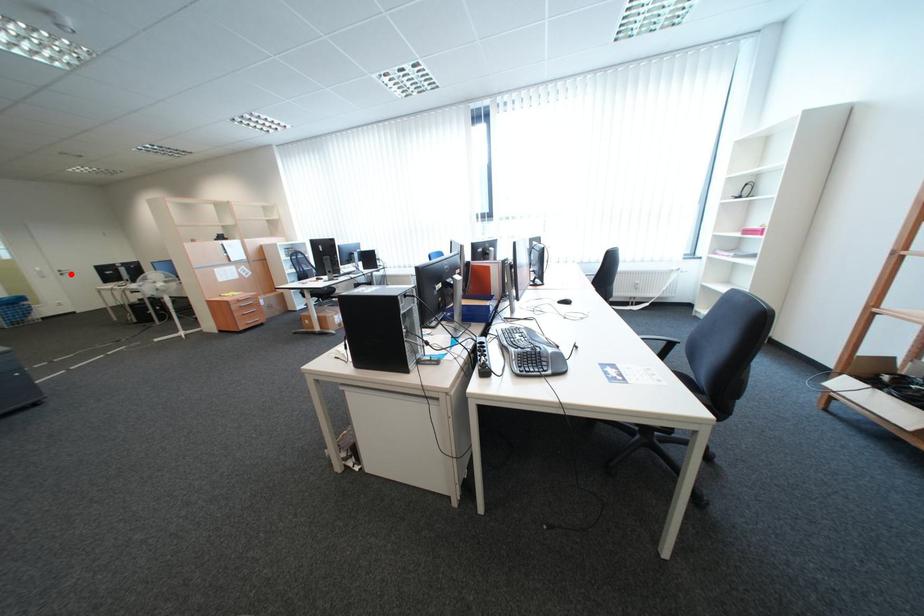
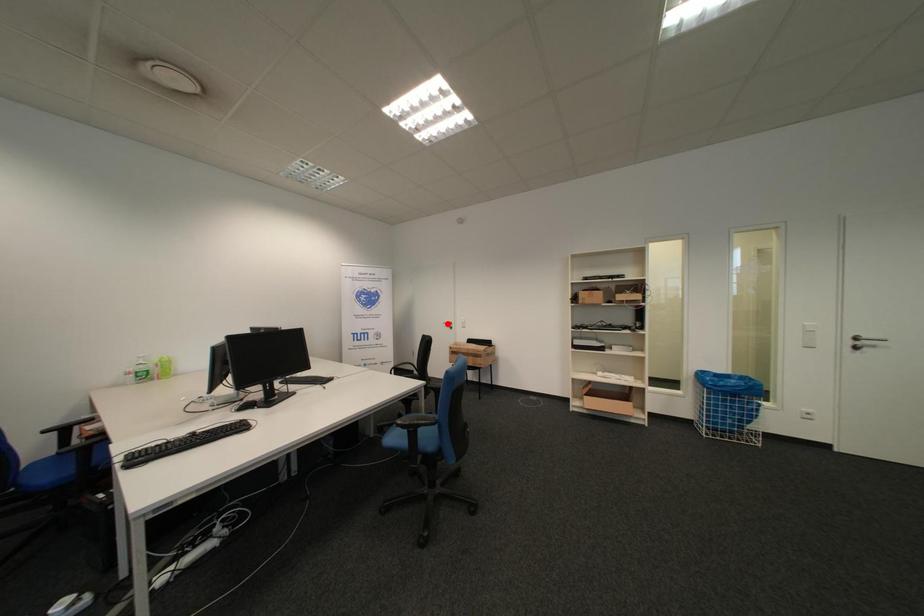
I am providing you with two images of the same scene from different viewpoints. A red point is marked on the first image and another point is marked on the second image. Is the red point in image1 aligned with the point shown in image2?

No